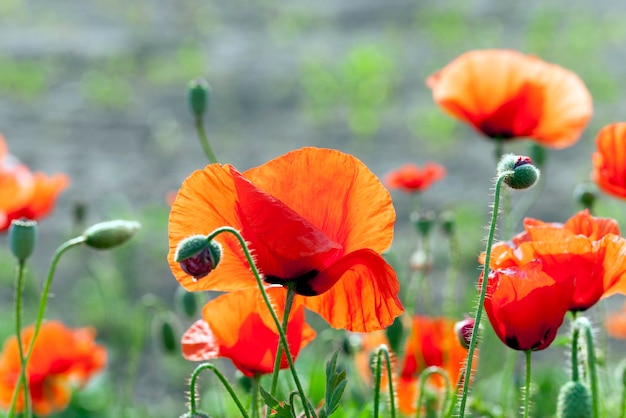
The height and width of the screenshot is (418, 626). I want to click on bulb, so click(x=526, y=175).